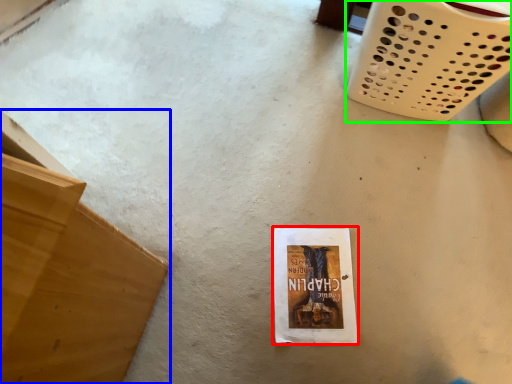
Question: Which is farther away from paperback book (highlighted by a red box)? furniture (highlighted by a blue box) or basket (highlighted by a green box)?

Choices:
 (A) furniture
 (B) basket

Answer: (B)